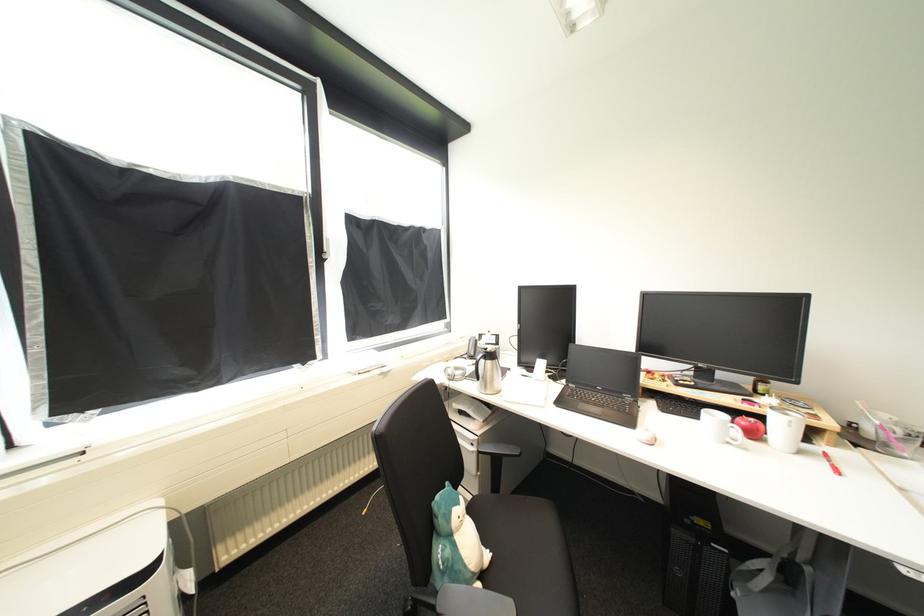
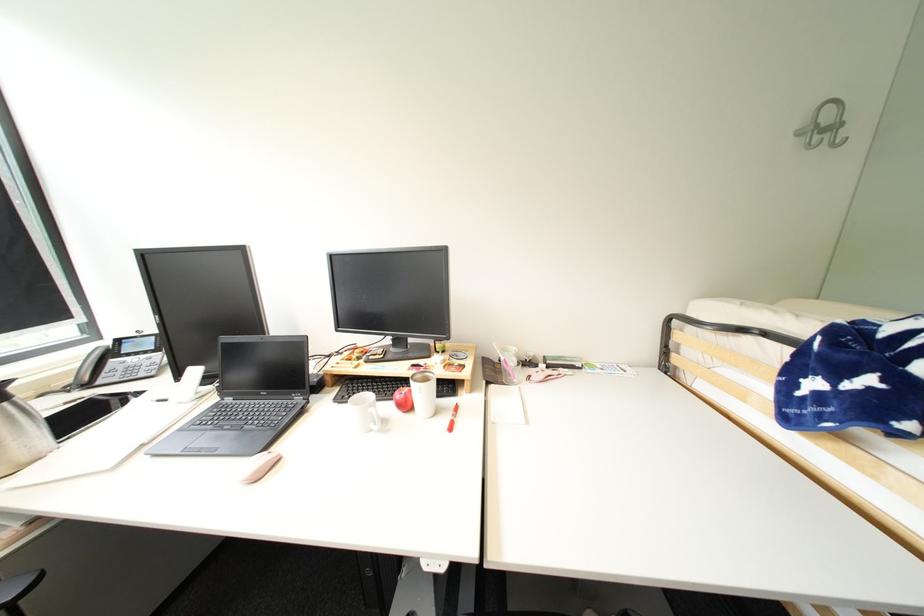
The point at (655,442) is marked in the first image. Where is the corresponding point in the second image?

(254, 480)